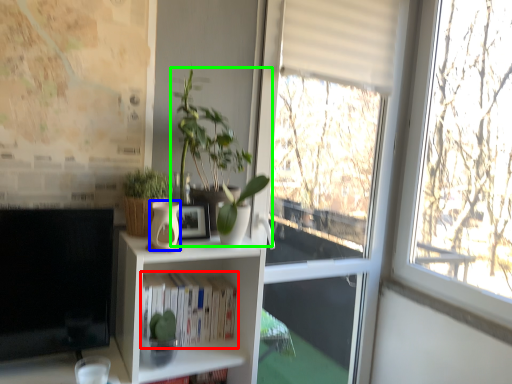
Question: Which is farther away from book (highlighted by a red box)? vase (highlighted by a blue box) or houseplant (highlighted by a green box)?

Choices:
 (A) vase
 (B) houseplant

Answer: (B)